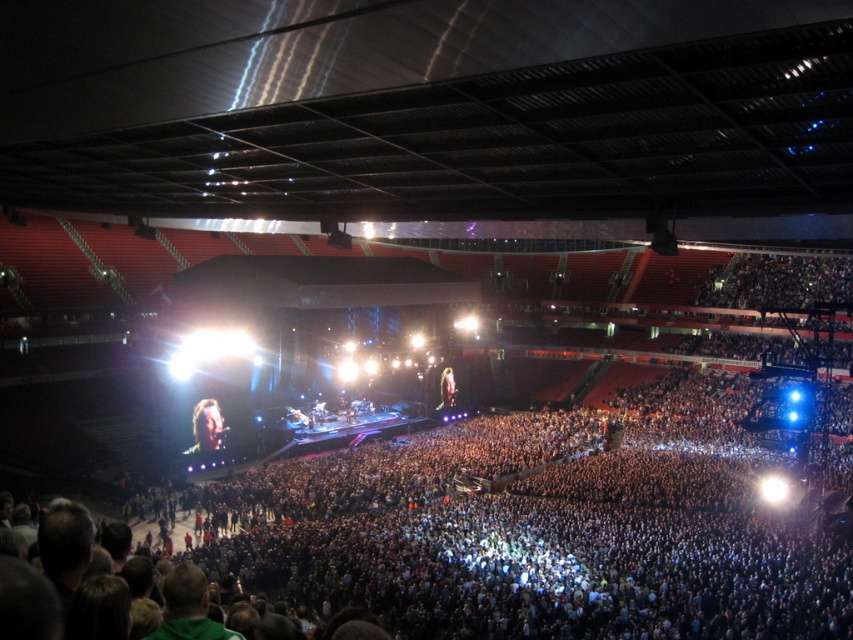
Question: From the image, what is the correct spatial relationship of shiny brown hair at center in relation to shiny gold hair at center?

Choices:
 (A) below
 (B) above

Answer: (A)

Question: Is shiny brown hair at center to the left of shiny gold hair at center from the viewer's perspective?

Choices:
 (A) yes
 (B) no

Answer: (A)

Question: Among these points, which one is nearest to the camera?

Choices:
 (A) (440, 385)
 (B) (207, 410)

Answer: (B)

Question: Among these objects, which one is nearest to the camera?

Choices:
 (A) shiny brown hair at center
 (B) shiny gold hair at center

Answer: (A)

Question: Where is shiny brown hair at center located in relation to shiny gold hair at center in the image?

Choices:
 (A) left
 (B) right

Answer: (A)